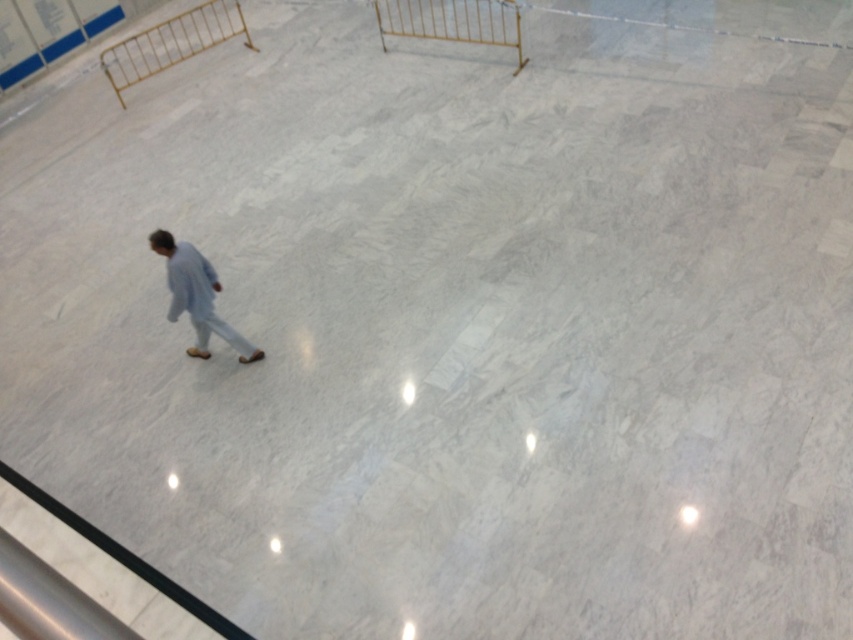
Who is more forward, (154, 72) or (167, 241)?

Point (167, 241)

Find the location of a particular element. This screenshot has width=853, height=640. gold metallic rail at upper left is located at coordinates (171, 42).

Is gold metallic rail at upper center to the right of light blue fabric at center from the viewer's perspective?

Indeed, gold metallic rail at upper center is positioned on the right side of light blue fabric at center.

Can you confirm if gold metallic rail at upper center is taller than light blue fabric at center?

Yes, gold metallic rail at upper center is taller than light blue fabric at center.

The height and width of the screenshot is (640, 853). Describe the element at coordinates (451, 20) in the screenshot. I see `gold metallic rail at upper center` at that location.

Image resolution: width=853 pixels, height=640 pixels. Find the location of `gold metallic rail at upper center`. gold metallic rail at upper center is located at coordinates (451, 20).

Does gold metallic rail at upper left have a greater width compared to gold metallic rail at upper center?

Indeed, gold metallic rail at upper left has a greater width compared to gold metallic rail at upper center.

Who is more distant from viewer, (106, 52) or (505, 38)?

Point (106, 52)

Identify the location of gold metallic rail at upper left. (171, 42).